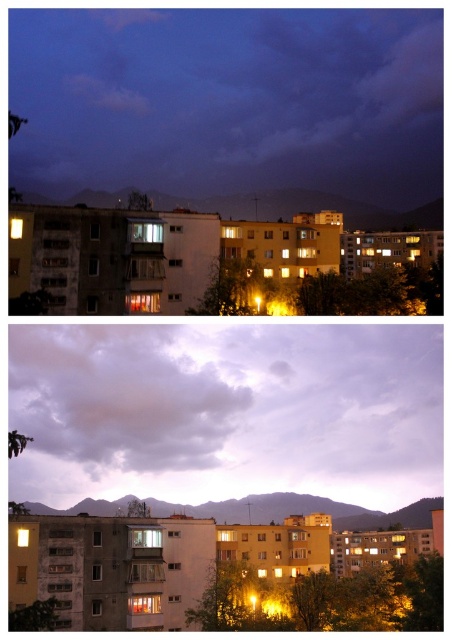
Question: Does gray cotton cloud at upper center appear on the right side of matte yellow light at center?

Choices:
 (A) no
 (B) yes

Answer: (A)

Question: Based on their relative distances, which object is farther from the gray cotton cloud at upper center?

Choices:
 (A) matte yellow light at center
 (B) cloudy sky at upper center

Answer: (A)

Question: Is gray cotton cloud at upper center to the left of matte yellow light at center from the viewer's perspective?

Choices:
 (A) yes
 (B) no

Answer: (A)

Question: Can you confirm if cloudy sky at upper center is positioned to the left of gray cotton cloud at upper center?

Choices:
 (A) yes
 (B) no

Answer: (B)

Question: Which of the following is the farthest from the observer?

Choices:
 (A) cloudy sky at upper center
 (B) gray cotton cloud at upper center

Answer: (B)

Question: Which object appears farthest from the camera in this image?

Choices:
 (A) cloudy sky at upper center
 (B) gray cotton cloud at upper center
 (C) matte yellow light at center

Answer: (B)